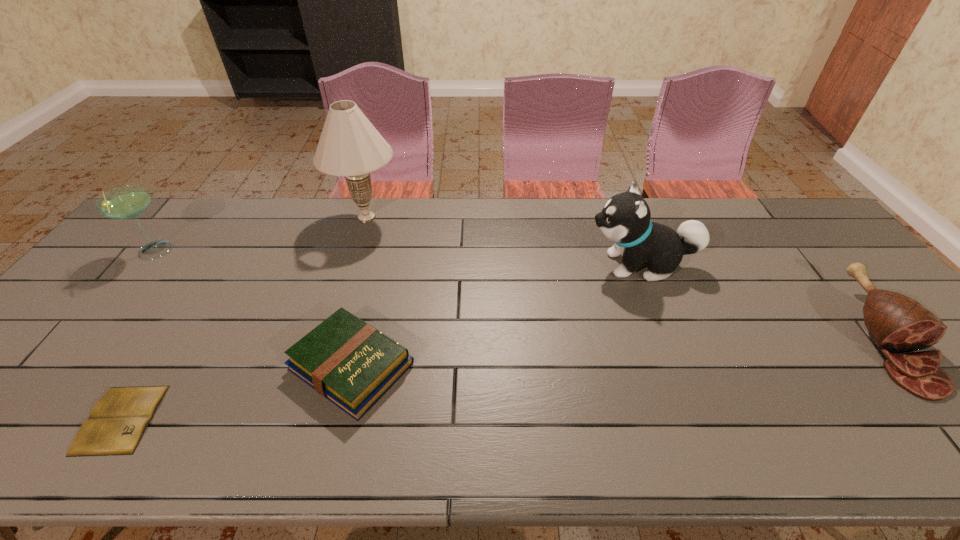
In the image, there is a desktop. Where is `vacant space at the far edge`? vacant space at the far edge is located at coordinates [578, 231].

The image size is (960, 540). In the image, there is a desktop. Find the location of `vacant space at the near edge`. vacant space at the near edge is located at coordinates (671, 443).

Where is `free space at the left edge of the desktop`? Image resolution: width=960 pixels, height=540 pixels. free space at the left edge of the desktop is located at coordinates (126, 246).

You are a GUI agent. You are given a task and a screenshot of the screen. Output one action in this format:
    pyautogui.click(x=<x>, y=<y>)
    Task: Click on the vacant region at the right edge of the desktop
    
    Given the screenshot: What is the action you would take?
    coord(844,316)

In the image, there is a desktop. Where is `vacant space at the far right corner`? The width and height of the screenshot is (960, 540). vacant space at the far right corner is located at coordinates [x=784, y=219].

This screenshot has width=960, height=540. In order to click on empty space between the lampshade and the shortest object in this screenshot , I will do `click(244, 318)`.

Identify the location of vacant area between the second object from right to left and the fifth tallest object. (496, 315).

You are a GUI agent. You are given a task and a screenshot of the screen. Output one action in this format:
    pyautogui.click(x=<x>, y=<y>)
    Task: Click on the vacant point located between the martini and the shortest object
    The width and height of the screenshot is (960, 540).
    Given the screenshot: What is the action you would take?
    pyautogui.click(x=137, y=335)

Identify the location of vacant region between the fifth shortest object and the leftmost object. (396, 258).

At what (x,y) coordinates should I click in order to perform the action: click on vacant area between the second object from left to right and the fifth tallest object. Please return your answer as a coordinate pair (x, y). The image size is (960, 540). Looking at the image, I should click on (236, 393).